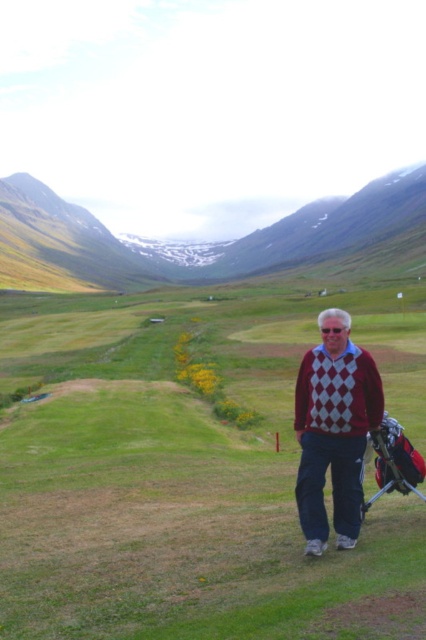
Question: Which of these objects is positioned farthest from the green grassy field at center?

Choices:
 (A) green grassy hillside at center
 (B) maroon diamond-patterned sweater at center

Answer: (A)

Question: Which point appears closest to the camera in this image?

Choices:
 (A) (270, 385)
 (B) (327, 448)
 (C) (178, 244)

Answer: (B)

Question: Does green grassy field at center have a greater width compared to green grassy hillside at center?

Choices:
 (A) yes
 (B) no

Answer: (B)

Question: Is the position of green grassy field at center less distant than that of green grassy hillside at center?

Choices:
 (A) no
 (B) yes

Answer: (B)

Question: Which of the following is the closest to the observer?

Choices:
 (A) maroon diamond-patterned sweater at center
 (B) green grassy field at center
 (C) green grassy hillside at center

Answer: (B)

Question: Where is green grassy hillside at center located in relation to maroon diamond-patterned sweater at center in the image?

Choices:
 (A) above
 (B) below

Answer: (A)